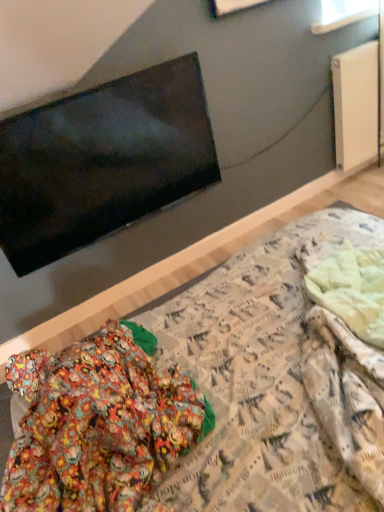
Question: Should I look upward or downward to see patterned fabric bed at center?

Choices:
 (A) down
 (B) up

Answer: (A)

Question: From a real-world perspective, is white matte radiator at upper right beneath patterned fabric bed at center?

Choices:
 (A) no
 (B) yes

Answer: (B)

Question: Can we say white matte radiator at upper right lies outside patterned fabric bed at center?

Choices:
 (A) no
 (B) yes

Answer: (B)

Question: Does white matte radiator at upper right have a greater height compared to patterned fabric bed at center?

Choices:
 (A) yes
 (B) no

Answer: (B)

Question: Is white matte radiator at upper right positioned with its back to patterned fabric bed at center?

Choices:
 (A) yes
 (B) no

Answer: (B)

Question: Considering the relative positions of white matte radiator at upper right and patterned fabric bed at center in the image provided, is white matte radiator at upper right to the right of patterned fabric bed at center from the viewer's perspective?

Choices:
 (A) no
 (B) yes

Answer: (B)

Question: Is white matte radiator at upper right wider than patterned fabric bed at center?

Choices:
 (A) yes
 (B) no

Answer: (B)

Question: Can you confirm if white matte radiator at upper right is shorter than flat matte black tv at upper left?

Choices:
 (A) no
 (B) yes

Answer: (A)

Question: Is white matte radiator at upper right at the left side of flat matte black tv at upper left?

Choices:
 (A) no
 (B) yes

Answer: (A)

Question: Is white matte radiator at upper right positioned far away from flat matte black tv at upper left?

Choices:
 (A) no
 (B) yes

Answer: (B)

Question: Can you confirm if white matte radiator at upper right is wider than flat matte black tv at upper left?

Choices:
 (A) yes
 (B) no

Answer: (B)

Question: Considering the relative positions of white matte radiator at upper right and flat matte black tv at upper left in the image provided, is white matte radiator at upper right to the right of flat matte black tv at upper left from the viewer's perspective?

Choices:
 (A) yes
 (B) no

Answer: (A)

Question: Is white matte radiator at upper right thinner than flat matte black tv at upper left?

Choices:
 (A) yes
 (B) no

Answer: (A)

Question: Can you confirm if flat matte black tv at upper left is taller than white matte radiator at upper right?

Choices:
 (A) yes
 (B) no

Answer: (B)